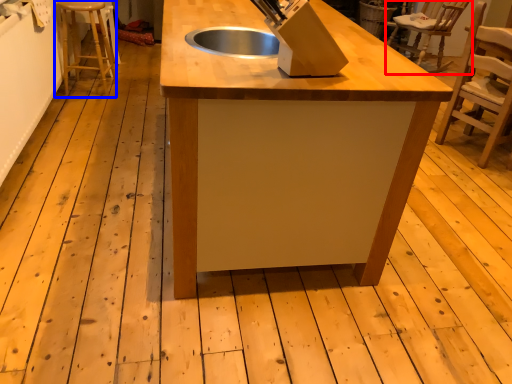
Question: Which object is further to the camera taking this photo, chair (highlighted by a red box) or step stool (highlighted by a blue box)?

Choices:
 (A) chair
 (B) step stool

Answer: (A)